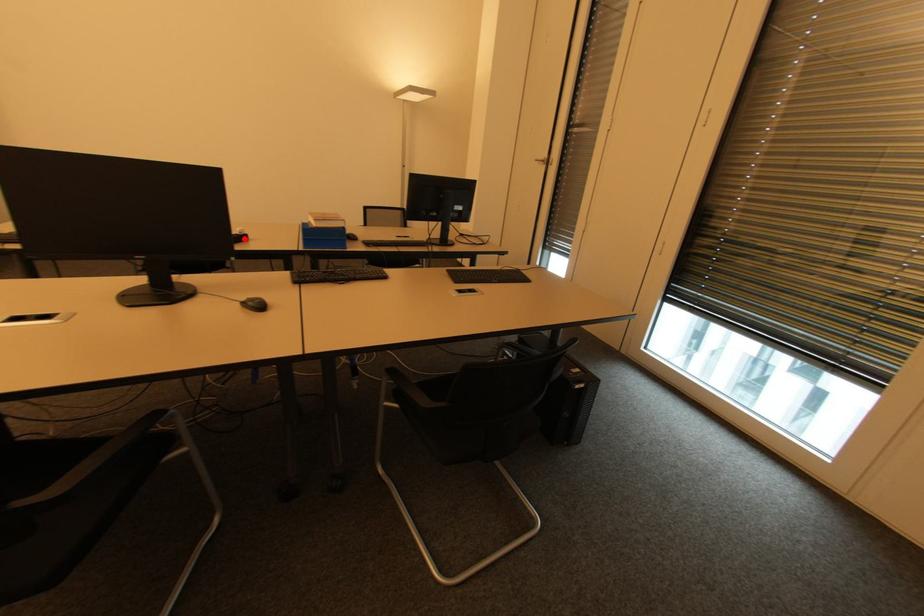
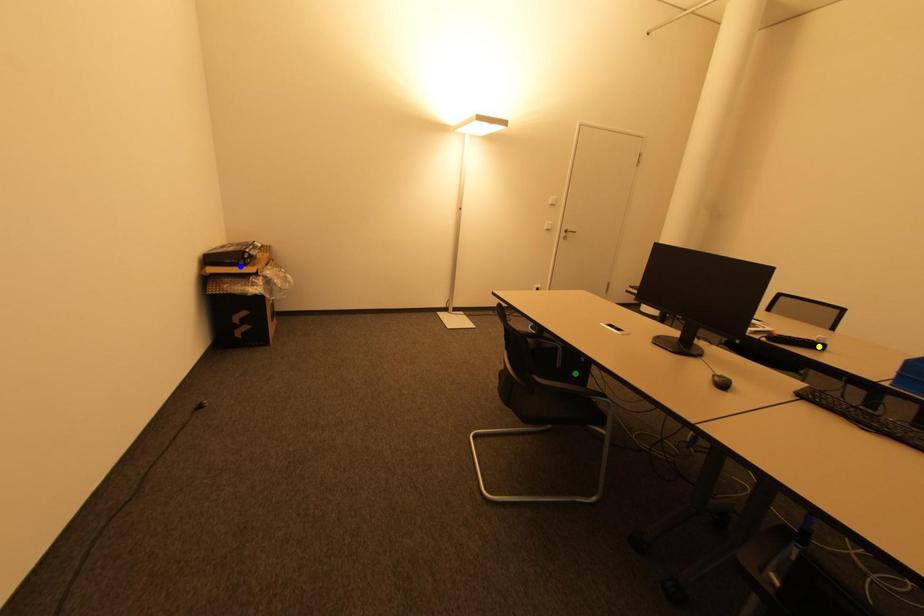
Question: I am providing you with two images of the same scene from different viewpoints. A red point is marked on the first image. You are given multiple points on the second image. Can you choose the point in image 2 that corresponds to the point in image 1?

Choices:
 (A) yellow point
 (B) green point
 (C) blue point

Answer: (A)